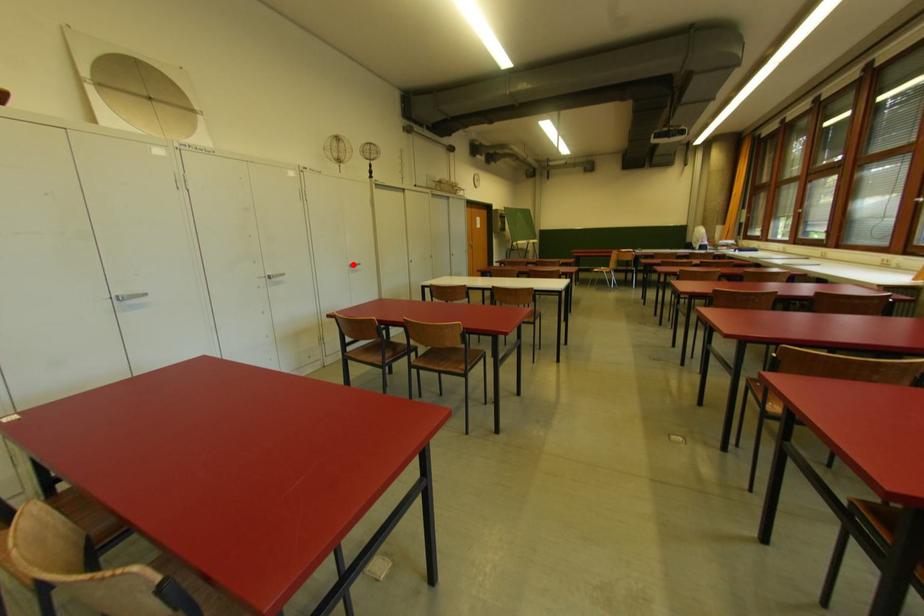
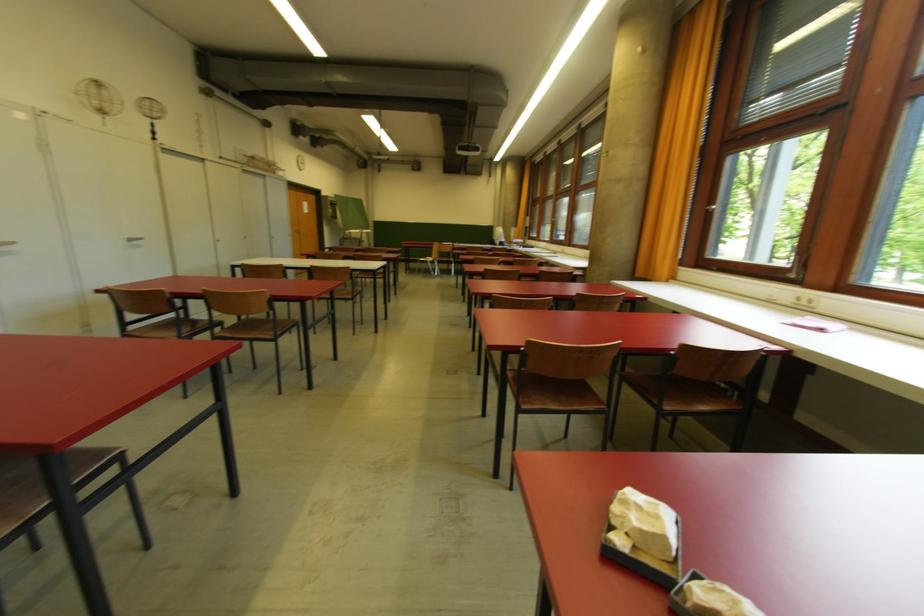
Where in the second image is the point corresponding to the highlighted location from the first image?

(130, 238)